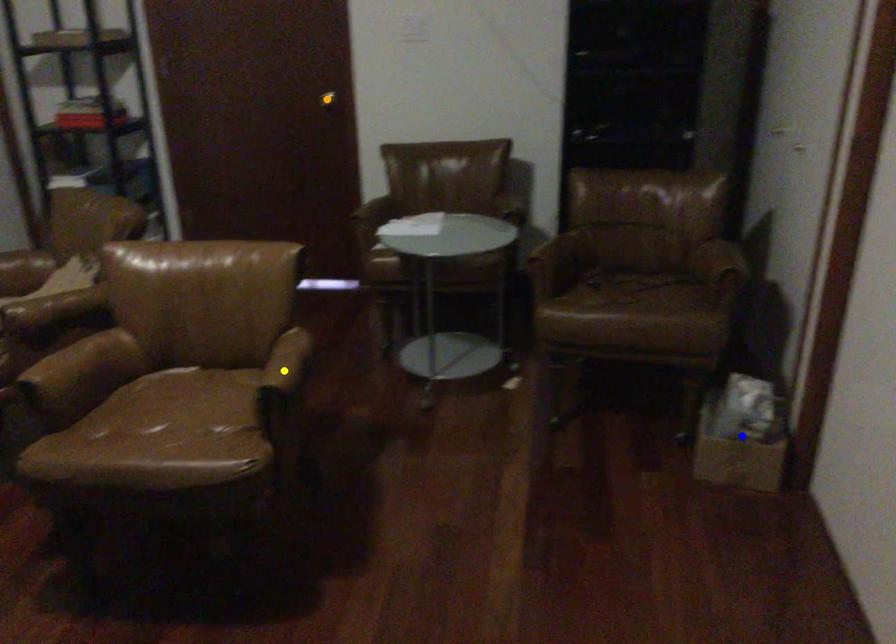
Order these from nearest to farthest:
1. blue point
2. orange point
3. yellow point

yellow point → blue point → orange point